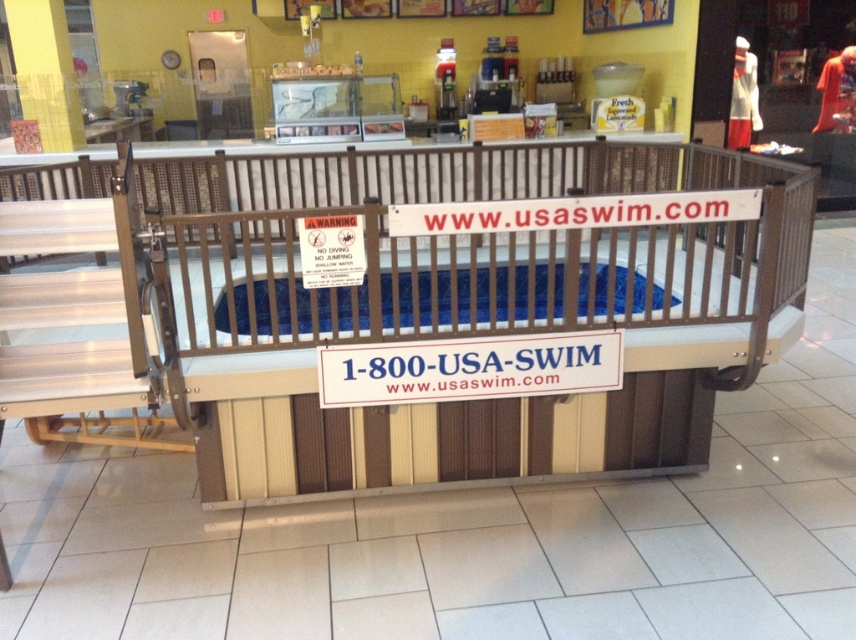
You are a parent at the indoor pool area and want to put your baby in the blue plastic infant bed at center. Before doing so, you notice the white plastic sign at center. What is the relationship between the sign and the infant bed in terms of their positions?

The white plastic sign at center is positioned on the right side of the blue plastic infant bed at center, meaning the sign is to the right of the bed.

You are standing in front of the pool and want to take a photo. You notice two points marked in the image. Which point, point (x=321, y=328) or point (x=480, y=273), is closer to your camera?

Point (x=321, y=328) is closer to the camera than point (x=480, y=273).

Looking at this image, you are standing in front of the swimming pool setup and want to determine the relative positions of two points marked on the pool fence. Which point, point at coordinate (621, 268) or point at coordinate (483, 394), is closer to you?

Point at coordinate (621, 268) is closer to you because it is further to the viewer than point at coordinate (483, 394).